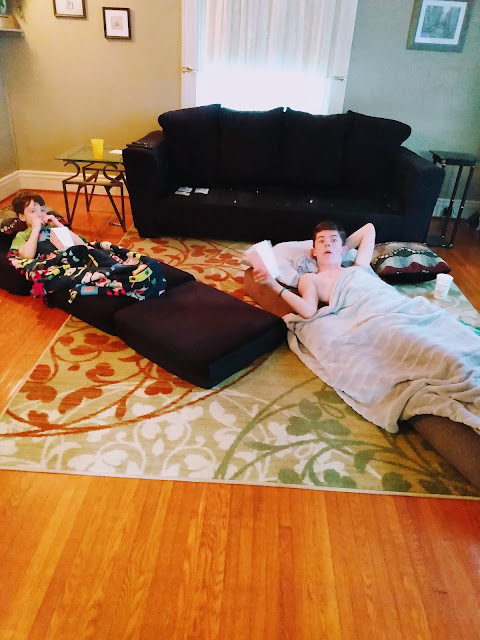
Find the location of a particular element. This screenshot has width=480, height=640. walls is located at coordinates (1, 147), (80, 84), (438, 82).